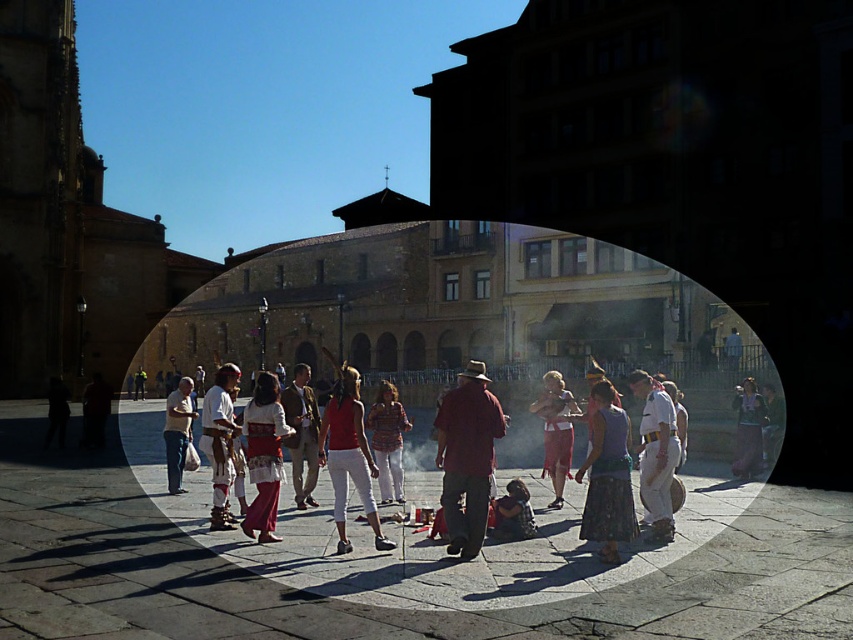
Is point (418, 324) positioned before point (259, 408)?

No.

Does matte red skirt at center appear on the left side of embroidered fabric dress at center?

Correct, you'll find matte red skirt at center to the left of embroidered fabric dress at center.

Is point (219, 342) behind point (253, 476)?

Yes, it is.

Locate an element on the screen. matte red skirt at center is located at coordinates (434, 394).

Who is higher up, matte red shirt at center or light beige pants at lower left?

matte red shirt at center is above.

Which of these two, matte red shirt at center or light beige pants at lower left, stands shorter?

light beige pants at lower left is shorter.

Is point (500, 433) positioned after point (189, 413)?

No, it is not.

The height and width of the screenshot is (640, 853). Identify the location of matte red shirt at center. (467, 456).

Is matte red shirt at center positioned behind matte purple skirt at center?

Yes, matte red shirt at center is further from the viewer.

Does point (480, 534) come behind point (612, 524)?

That is False.

Is point (482, 444) farther from viewer compared to point (596, 534)?

Yes.

Where is `matte red shirt at center`? The image size is (853, 640). matte red shirt at center is located at coordinates (467, 456).